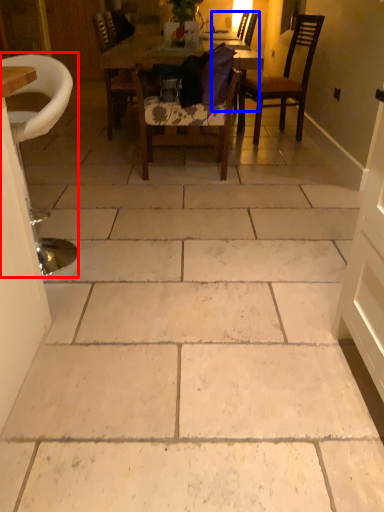
Question: Which point is further to the camera, chair (highlighted by a red box) or chair (highlighted by a blue box)?

Choices:
 (A) chair
 (B) chair

Answer: (B)